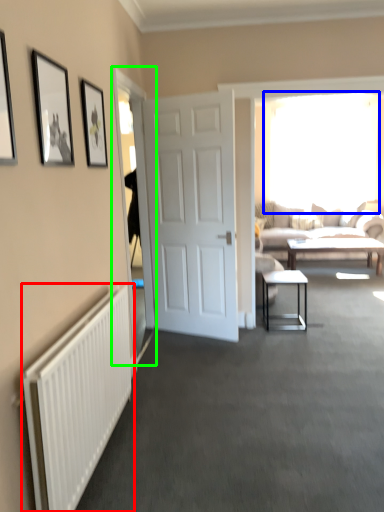
Question: Based on their relative distances, which object is nearer to radiator (highlighted by a red box)? Choose from window (highlighted by a blue box) and glass door (highlighted by a green box).

Choices:
 (A) window
 (B) glass door

Answer: (B)